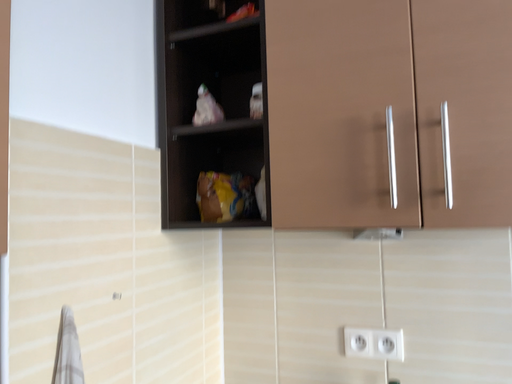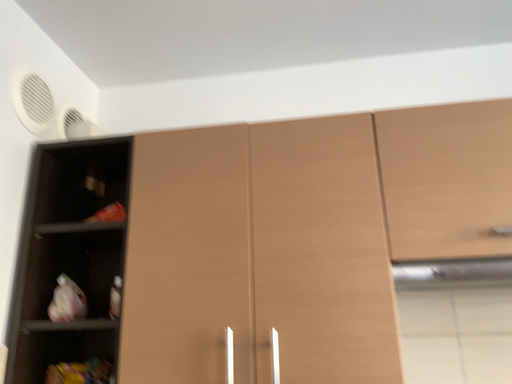
Question: How did the camera likely rotate when shooting the video?

Choices:
 (A) rotated upward
 (B) rotated downward

Answer: (A)